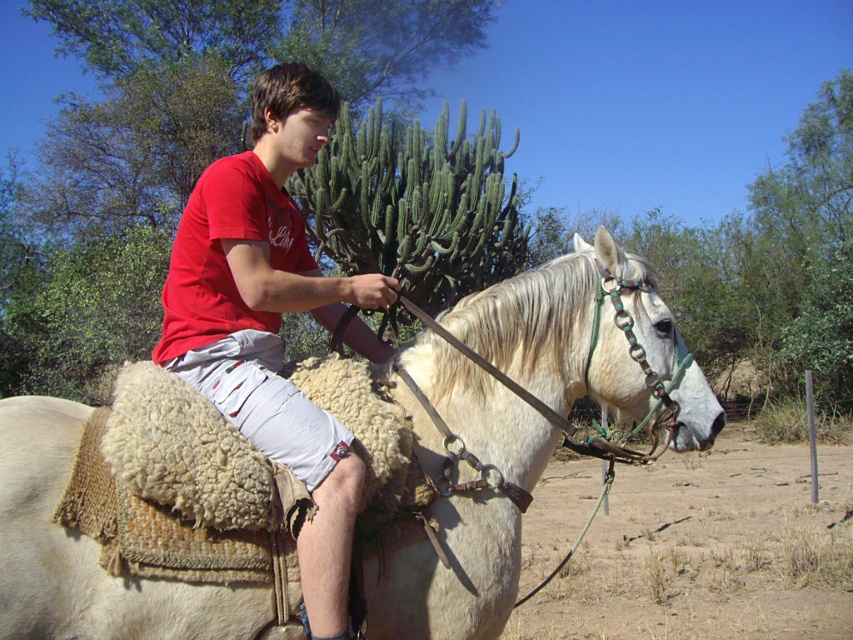
Is white woolen saddle at center thinner than matte red t-shirt at center?

No.

Is white woolen saddle at center positioned at the back of matte red t-shirt at center?

Yes.

Is point (90, 584) positioned before point (183, 280)?

Yes, it is in front of point (183, 280).

Locate an element on the screen. white woolen saddle at center is located at coordinates (86, 552).